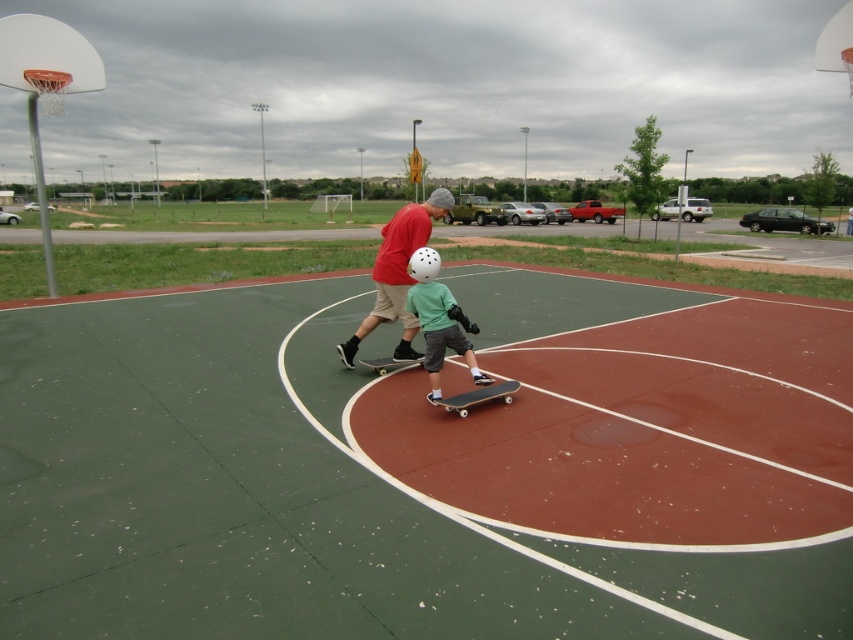
Looking at this image, you are standing at the edge of the basketball court and want to roll a ball from the white plastic basketball hoop at upper left to the metallic silver skateboard at center. In which direction should you roll the ball?

You should roll the ball to the right because the white plastic basketball hoop at upper left is to the left of the metallic silver skateboard at center.

You are a basketball hoop installer checking the court dimensions. The standard width for a basketball hoop is 1.8 meters. If the metallic silver skateboard at center is 0.5 meters wide, can the white plastic basketball hoop at upper left fit within the standard width requirement?

The white plastic basketball hoop at upper left might be wider than metallic silver skateboard at center, which is 0.5 meters wide. Since the basketball hoop might exceed this width, it may not fit within the standard 1.8 meters requirement. Further measurement is needed.